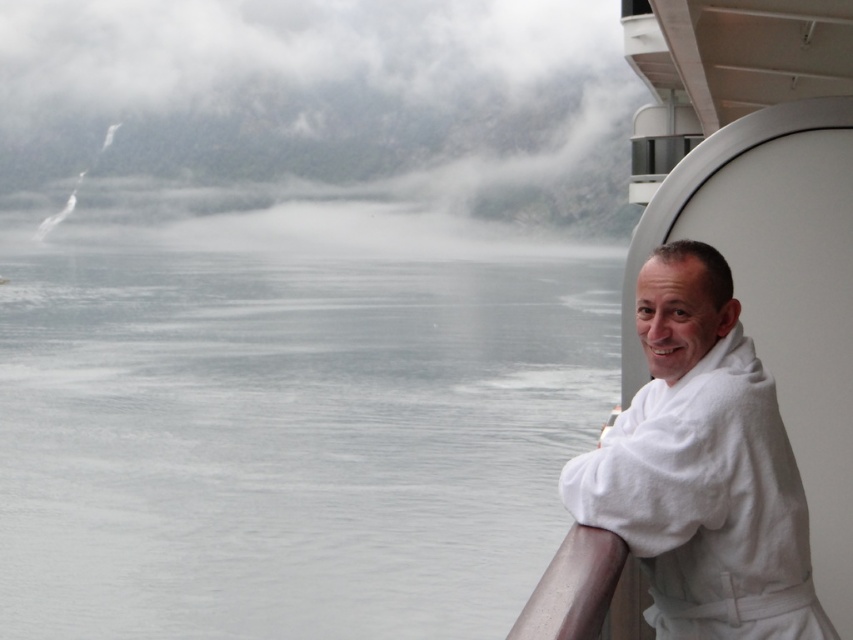
Question: Does gray water at left have a smaller size compared to white misty fog at upper left?

Choices:
 (A) yes
 (B) no

Answer: (B)

Question: Which point is closer to the camera?

Choices:
 (A) white misty fog at upper left
 (B) satin silver railing at lower right
 (C) white bathrobe at right

Answer: (B)

Question: Is white bathrobe at right below satin silver railing at lower right?

Choices:
 (A) no
 (B) yes

Answer: (A)

Question: Which object is closer to the camera taking this photo?

Choices:
 (A) white misty fog at upper left
 (B) satin silver railing at lower right
 (C) gray water at left

Answer: (B)

Question: Does gray water at left appear over white misty fog at upper left?

Choices:
 (A) yes
 (B) no

Answer: (B)

Question: Which point is farther from the camera taking this photo?

Choices:
 (A) (563, 604)
 (B) (537, 212)

Answer: (B)